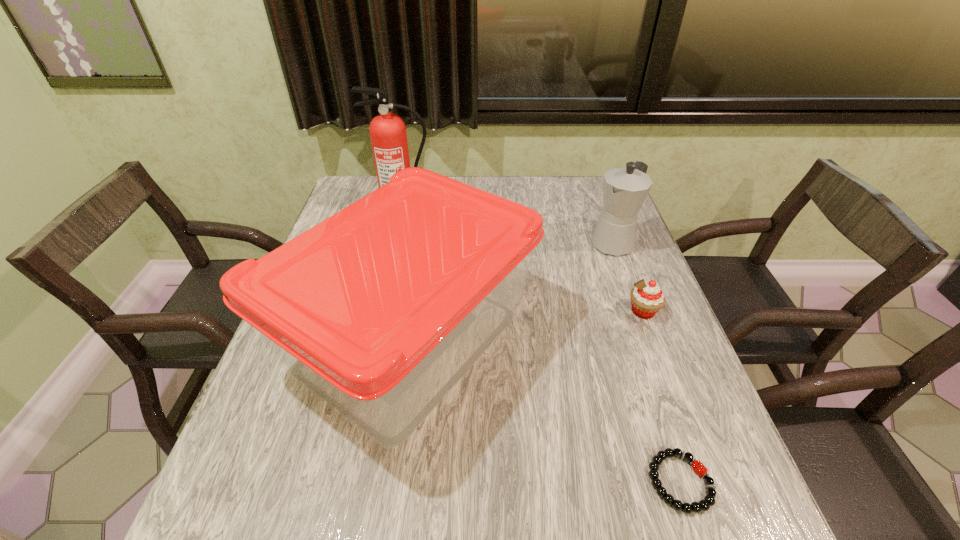
Locate an element on the screen. This screenshot has height=540, width=960. blank area in the image that satisfies the following two spatial constraints: 1. on the handle side of the shortest object; 2. on the right side of the tallest object is located at coordinates (337, 482).

Image resolution: width=960 pixels, height=540 pixels. I want to click on vacant space that satisfies the following two spatial constraints: 1. on the handle side of the fire extinguisher; 2. on the left side of the cupcake, so click(x=377, y=311).

The width and height of the screenshot is (960, 540). What are the coordinates of `vacant space that satisfies the following two spatial constraints: 1. on the handle side of the cupcake; 2. on the left side of the fire extinguisher` in the screenshot? It's located at (377, 311).

You are a GUI agent. You are given a task and a screenshot of the screen. Output one action in this format:
    pyautogui.click(x=<x>, y=<y>)
    Task: Click on the vacant region that satisfies the following two spatial constraints: 1. on the back side of the second shortest object; 2. on the right side of the tray
    Image resolution: width=960 pixels, height=540 pixels.
    Given the screenshot: What is the action you would take?
    pyautogui.click(x=414, y=311)

The width and height of the screenshot is (960, 540). I want to click on free point that satisfies the following two spatial constraints: 1. on the back side of the fourth tallest object; 2. on the left side of the bracelet, so click(x=623, y=311).

At what (x,y) coordinates should I click in order to perform the action: click on vacant space that satisfies the following two spatial constraints: 1. on the handle side of the shortest object; 2. on the left side of the tallest object. Please return your answer as a coordinate pair (x, y). This screenshot has width=960, height=540. Looking at the image, I should click on (337, 482).